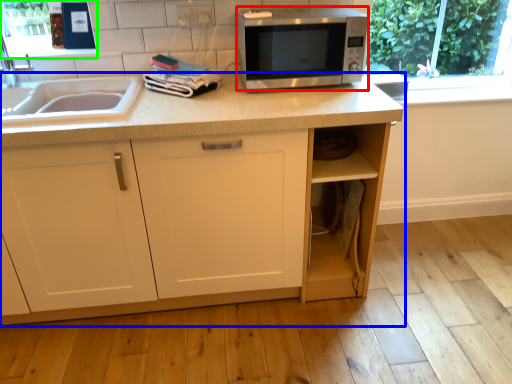
Question: Estimate the real-world distances between objects in this image. Which object is farther from microwave oven (highlighted by a red box), cabinetry (highlighted by a blue box) or window screen (highlighted by a green box)?

Choices:
 (A) cabinetry
 (B) window screen

Answer: (B)